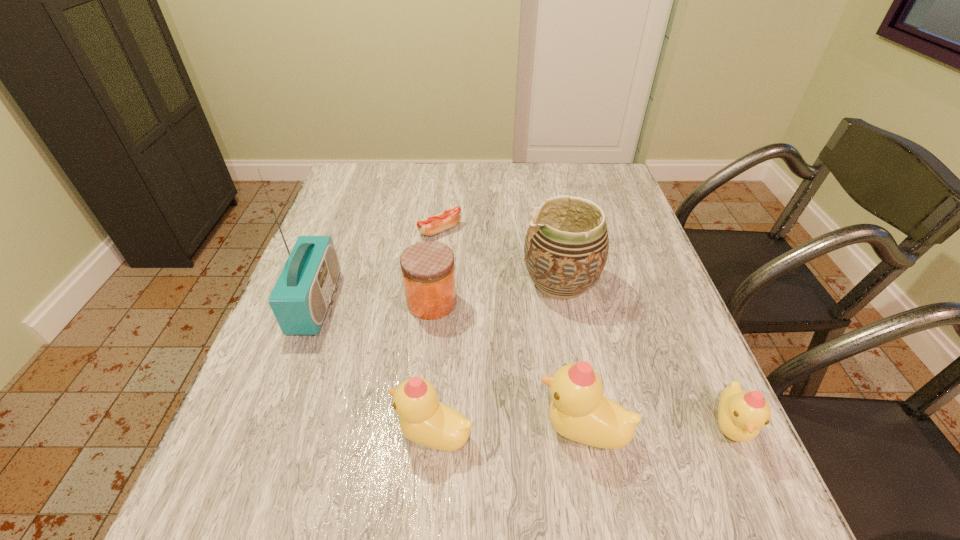
Where is `object that is at the left edge`? The image size is (960, 540). object that is at the left edge is located at coordinates (300, 298).

You are a GUI agent. You are given a task and a screenshot of the screen. Output one action in this format:
    pyautogui.click(x=<x>, y=<y>)
    Task: Click on the object at the right edge
    
    Given the screenshot: What is the action you would take?
    pyautogui.click(x=741, y=414)

Locate an element on the screen. The width and height of the screenshot is (960, 540). object that is positioned at the near right corner is located at coordinates 741,414.

The height and width of the screenshot is (540, 960). Find the location of `vacant space at the far edge of the desktop`. vacant space at the far edge of the desktop is located at coordinates (414, 194).

Where is `vacant space at the left edge`? This screenshot has height=540, width=960. vacant space at the left edge is located at coordinates (347, 226).

The height and width of the screenshot is (540, 960). Find the location of `vacant area at the right edge`. vacant area at the right edge is located at coordinates (614, 220).

The width and height of the screenshot is (960, 540). Find the location of `vacant space at the far left corner of the desktop`. vacant space at the far left corner of the desktop is located at coordinates (337, 191).

Find the location of `free region at the far right corner of the desktop`. free region at the far right corner of the desktop is located at coordinates (595, 164).

At what (x,y) coordinates should I click in order to perform the action: click on free space between the farthest object and the rightmost duckling. Please return your answer as a coordinate pair (x, y). Looking at the image, I should click on (585, 328).

Locate an element on the screen. free space between the pottery and the second duckling from left to right is located at coordinates (571, 356).